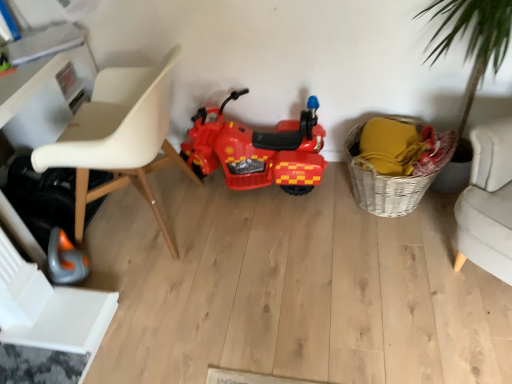
Find the location of a particular element. free space behind white plastic swivel chair at lower left is located at coordinates pos(120,263).